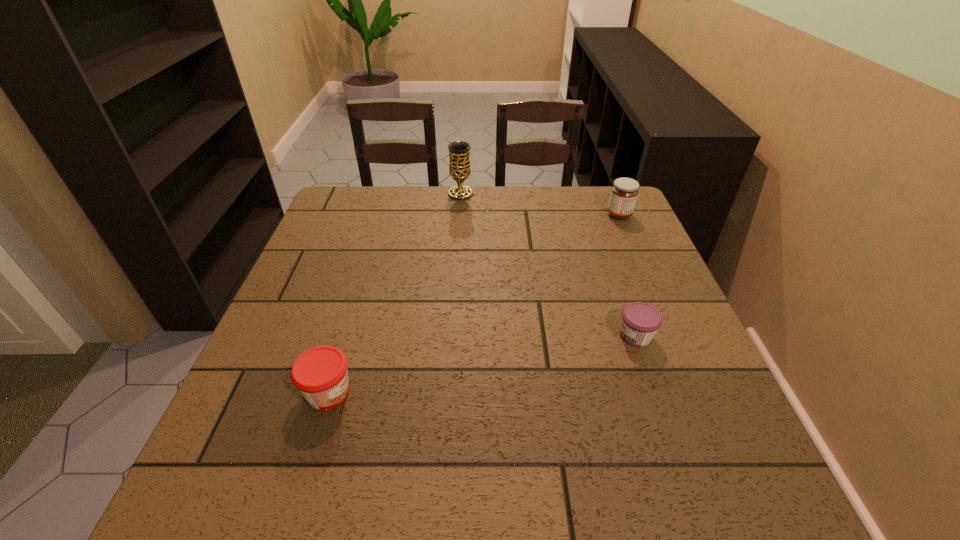
The height and width of the screenshot is (540, 960). I want to click on free area in between the tallest object and the third shortest object, so click(x=540, y=204).

This screenshot has width=960, height=540. I want to click on vacant point located between the farthest object and the second shortest object, so click(x=395, y=293).

Identify the location of vacant area that lies between the tallest object and the second shortest jam. The image size is (960, 540). (395, 293).

You are a GUI agent. You are given a task and a screenshot of the screen. Output one action in this format:
    pyautogui.click(x=<x>, y=<y>)
    Task: Click on the free spot between the nearest object and the tallest object
    
    Given the screenshot: What is the action you would take?
    pyautogui.click(x=395, y=293)

You are a GUI agent. You are given a task and a screenshot of the screen. Output one action in this format:
    pyautogui.click(x=<x>, y=<y>)
    Task: Click on the vacant space that is in between the third object from right to left and the shortest jam
    This screenshot has height=540, width=960.
    Given the screenshot: What is the action you would take?
    pyautogui.click(x=548, y=265)

Identify the location of object that is the second closest one to the nearest object. The height and width of the screenshot is (540, 960). (459, 151).

Identify which object is the closest to the second shortest jam. Please provide its 2D coordinates. Your answer should be formatted as a tuple, i.e. [(x, y)], where the tuple contains the x and y coordinates of a point satisfying the conditions above.

[(640, 321)]

The width and height of the screenshot is (960, 540). What are the coordinates of `jam that is the closest one to the tallest object` in the screenshot? It's located at (624, 192).

Point out which jam is positioned as the third nearest to the third object from right to left. Please provide its 2D coordinates. Your answer should be formatted as a tuple, i.e. [(x, y)], where the tuple contains the x and y coordinates of a point satisfying the conditions above.

[(321, 375)]

The height and width of the screenshot is (540, 960). Identify the location of free location that satisfies the following two spatial constraints: 1. on the front side of the second farthest object; 2. on the left side of the chalice. (459, 215).